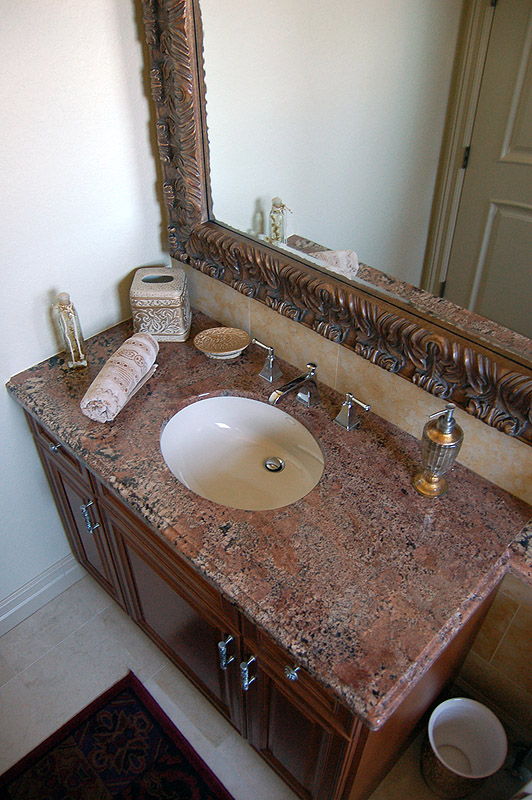
At what (x,y) coordinates should I click in order to perform the action: click on rolled up hand towel. Please return your answer as a coordinate pair (x, y). Looking at the image, I should click on (117, 368).